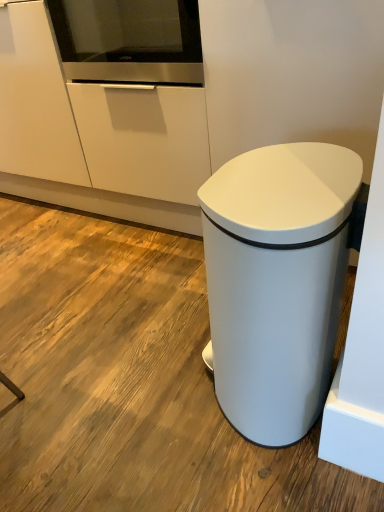
Where is `vacant space situated above white matte waste container at lower right (from a real-world perspective)`? This screenshot has width=384, height=512. vacant space situated above white matte waste container at lower right (from a real-world perspective) is located at coordinates (282, 176).